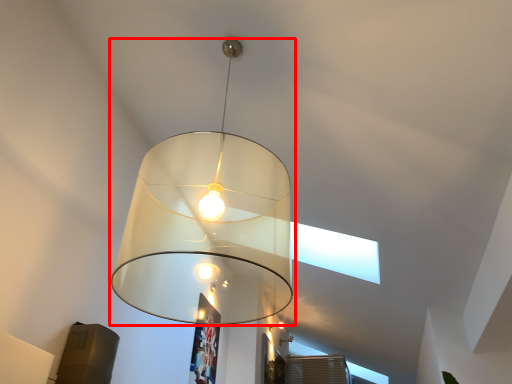
Question: Where is lamp (annotated by the red box) located in relation to lamp in the image?

Choices:
 (A) right
 (B) left

Answer: (B)